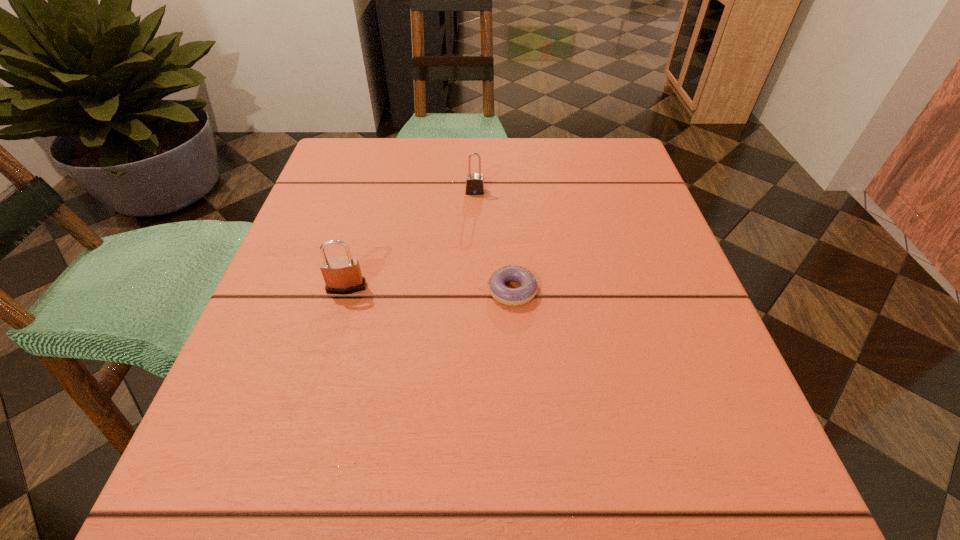
Where is `free space in the image that satisfies the following two spatial constraints: 1. on the shackle of the rightmost object; 2. on the right side of the second object from right to left`? free space in the image that satisfies the following two spatial constraints: 1. on the shackle of the rightmost object; 2. on the right side of the second object from right to left is located at coordinates (473, 291).